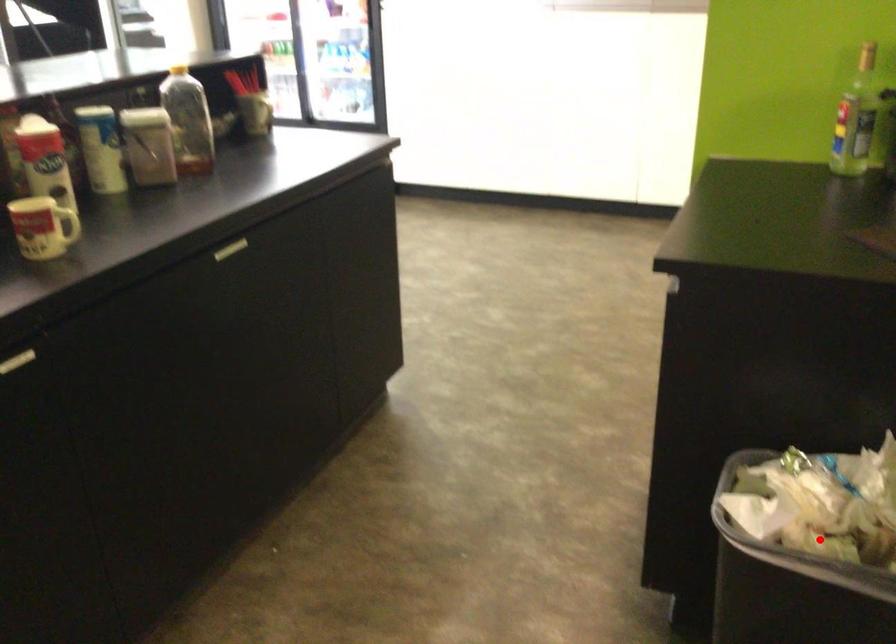
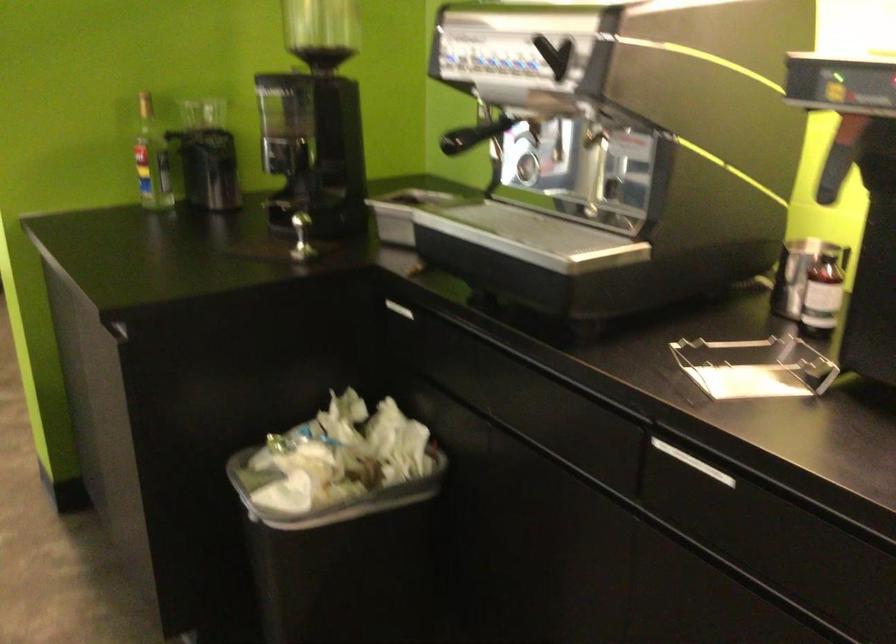
Question: I am providing you with two images of the same scene from different viewpoints. A red point is shown in image1. For the corresponding object point in image2, is it positioned nearer or farther from the camera?

Choices:
 (A) Nearer
 (B) Farther

Answer: (B)